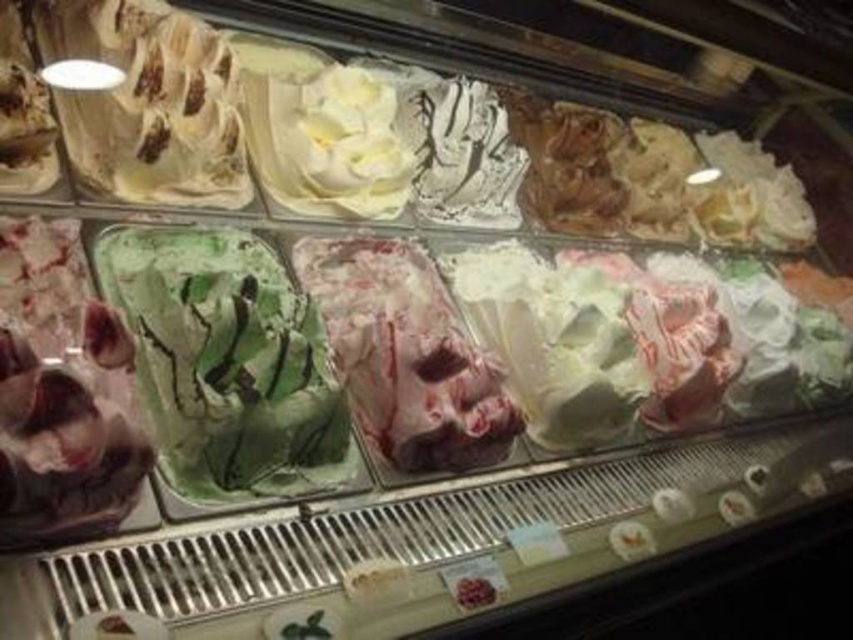
Question: Is green swirled ice cream at center in front of swirled pink ice cream at center?

Choices:
 (A) yes
 (B) no

Answer: (A)

Question: Which of the following is the farthest from the observer?

Choices:
 (A) (375, 353)
 (B) (187, 476)

Answer: (A)

Question: Is green swirled ice cream at center closer to camera compared to swirled pink ice cream at center?

Choices:
 (A) yes
 (B) no

Answer: (A)

Question: Does green swirled ice cream at center lie behind swirled pink ice cream at center?

Choices:
 (A) no
 (B) yes

Answer: (A)

Question: Which point is farther to the camera?

Choices:
 (A) swirled pink ice cream at center
 (B) green swirled ice cream at center

Answer: (A)